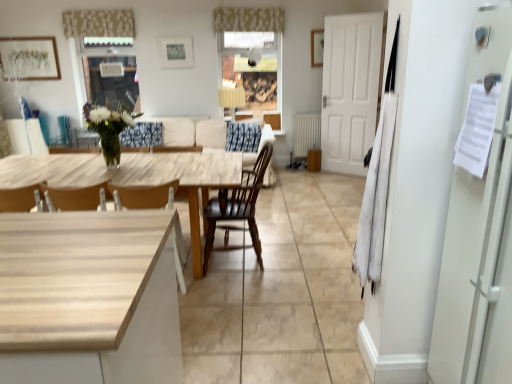
The height and width of the screenshot is (384, 512). What are the coordinates of `vacant area located to the right-hand side of dark brown wood chair at center, which is counted as the first chair, starting from the right` in the screenshot? It's located at (298, 260).